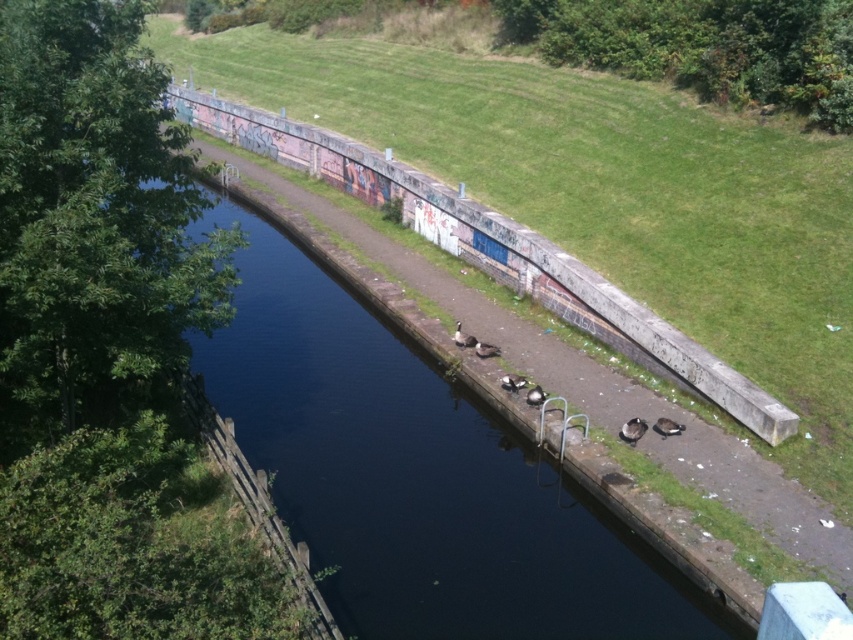
Who is taller, dark concrete river at center or brown matte duck at center?

Standing taller between the two is dark concrete river at center.

Is dark concrete river at center shorter than brown matte duck at center?

In fact, dark concrete river at center may be taller than brown matte duck at center.

Does point (223, 202) lie behind point (480, 344)?

Yes, point (223, 202) is farther from viewer.

Find the location of a particular element. This screenshot has width=853, height=640. dark concrete river at center is located at coordinates pyautogui.click(x=416, y=476).

Is brown fuzzy duck at lower center wider than brown fuzzy duck at center?

No, brown fuzzy duck at lower center is not wider than brown fuzzy duck at center.

Can you confirm if brown fuzzy duck at lower center is positioned below brown fuzzy duck at center?

Yes, brown fuzzy duck at lower center is below brown fuzzy duck at center.

Which is behind, point (642, 424) or point (518, 388)?

The point (518, 388) is behind.

You are a GUI agent. You are given a task and a screenshot of the screen. Output one action in this format:
    pyautogui.click(x=<x>, y=<y>)
    Task: Click on the brown fuzzy duck at lower center
    This screenshot has width=853, height=640.
    Given the screenshot: What is the action you would take?
    pyautogui.click(x=631, y=429)

Who is positioned more to the left, green leafy tree at left or brown fuzzy duck at lower right?

Positioned to the left is green leafy tree at left.

Does green leafy tree at left appear on the right side of brown fuzzy duck at lower right?

In fact, green leafy tree at left is to the left of brown fuzzy duck at lower right.

Which is behind, point (13, 176) or point (669, 428)?

The point (669, 428) is behind.

Where is `green leafy tree at left`? Image resolution: width=853 pixels, height=640 pixels. green leafy tree at left is located at coordinates pos(93,221).